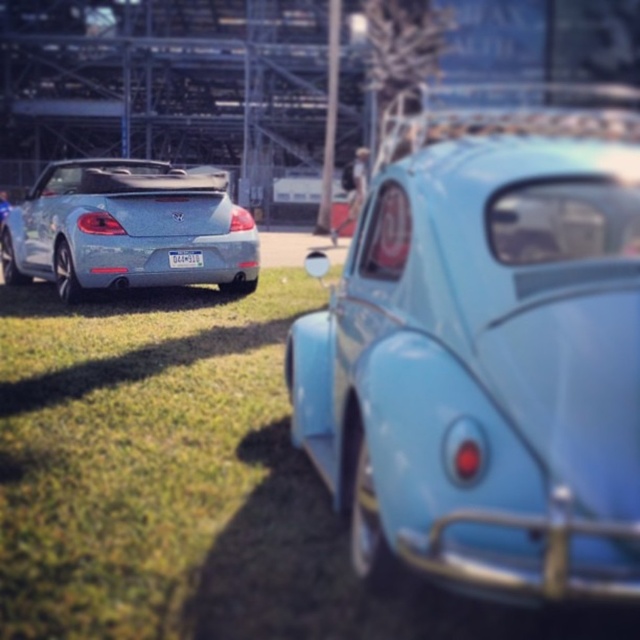
You are a photographer planning to take a picture of the light blue matte car at center and the satin silver convertible at left. Which car should you focus on if you want the one closer to the camera to be sharp?

The light blue matte car at center should be focused on because it is positioned under the satin silver convertible at left, indicating it is closer to the camera.

You are standing at the origin point in the image. The light blue matte car at center is located at coordinates 0.580, 0.759. Can you determine its position relative to the origin?

The light blue matte car at center is located at coordinates [484,371], which means it is positioned to the right and above the origin point.